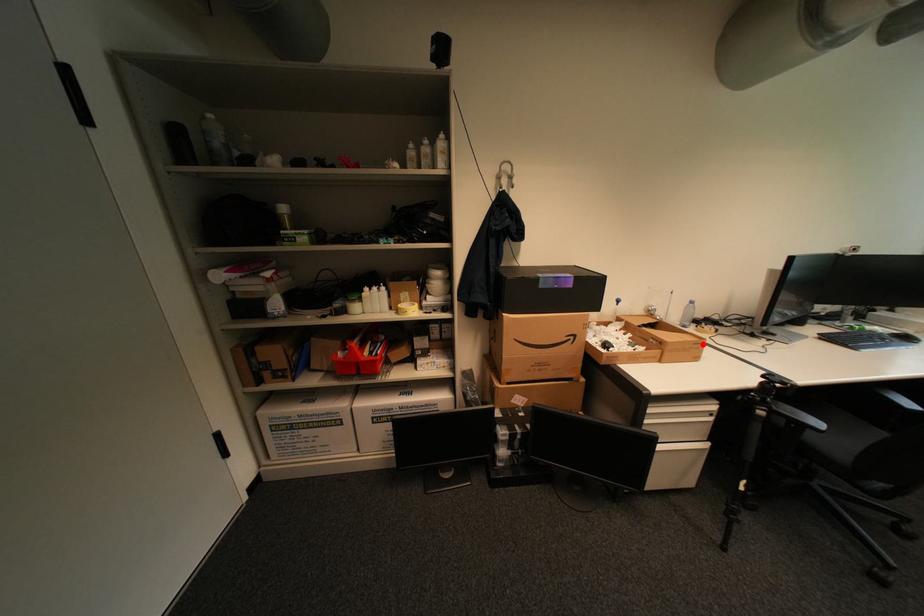
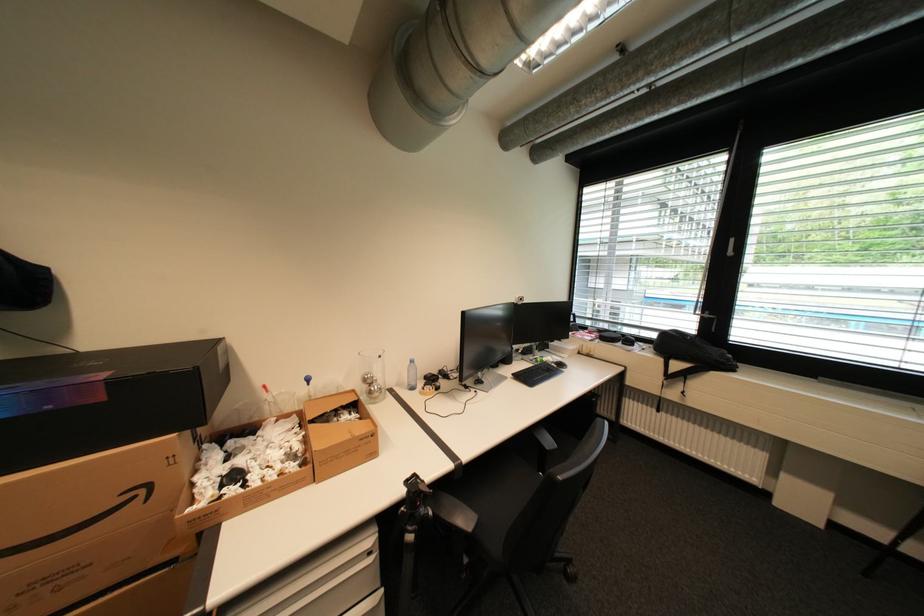
Locate, in the second image, the point that corresponds to the highlighted location in the first image.

(370, 440)